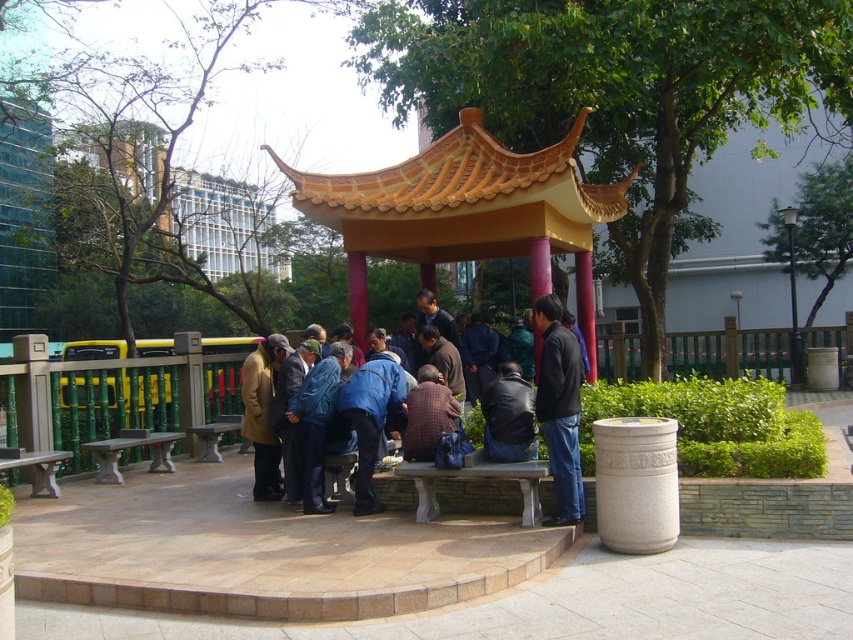
Which is in front, point (577, 193) or point (366, 433)?

Point (366, 433) is in front.

Between matte orange gazebo at center and blue fabric jacket at center, which one has more height?

matte orange gazebo at center is taller.

Measure the distance between point (347, 225) and camera.

A distance of 9.27 meters exists between point (347, 225) and camera.

Image resolution: width=853 pixels, height=640 pixels. I want to click on matte orange gazebo at center, so click(x=465, y=211).

Who is positioned more to the left, dark gray jacket at center or blue fabric jacket at center?

blue fabric jacket at center is more to the left.

Does dark gray jacket at center have a greater width compared to blue fabric jacket at center?

No.

I want to click on dark gray jacket at center, so [x=560, y=406].

The height and width of the screenshot is (640, 853). I want to click on dark gray jacket at center, so click(x=560, y=406).

Between matte orange gazebo at center and dark gray jacket at center, which one has less height?

Standing shorter between the two is matte orange gazebo at center.

In the scene shown: Does matte orange gazebo at center have a lesser width compared to dark gray jacket at center?

No.

What do you see at coordinates (465, 211) in the screenshot?
I see `matte orange gazebo at center` at bounding box center [465, 211].

The image size is (853, 640). Find the location of `matte orange gazebo at center`. matte orange gazebo at center is located at coordinates (465, 211).